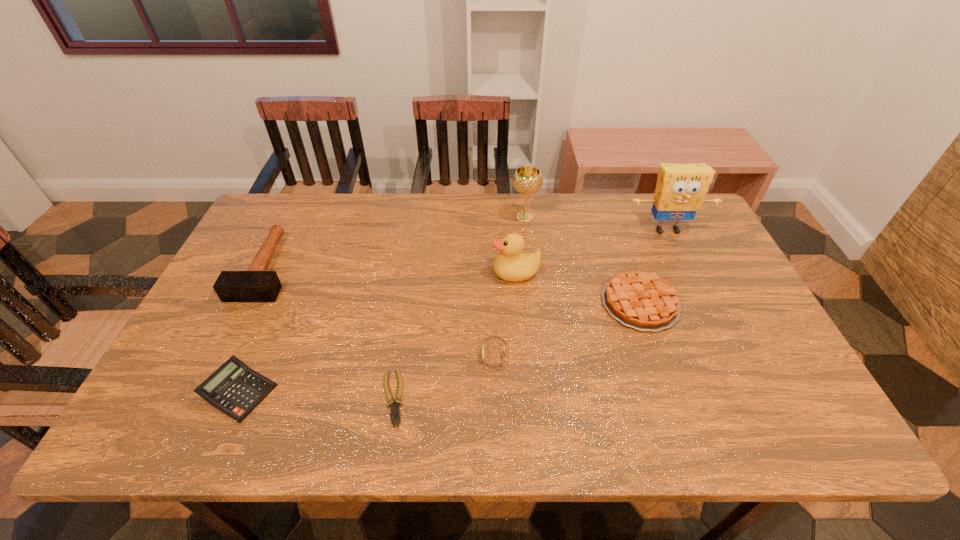
Locate an element on the screen. This screenshot has height=540, width=960. blank area located 0.300m on the right of the sixth object from right to left is located at coordinates (537, 399).

Locate an element on the screen. The image size is (960, 540). sponge at the far edge is located at coordinates (680, 190).

Locate an element on the screen. chalice positioned at the far edge is located at coordinates (527, 180).

The width and height of the screenshot is (960, 540). Identify the location of mallet at the far edge. (256, 284).

Locate an element on the screen. This screenshot has height=540, width=960. calculator located in the near edge section of the desktop is located at coordinates (235, 389).

The width and height of the screenshot is (960, 540). I want to click on pliers that is at the near edge, so click(394, 409).

You are a GUI agent. You are given a task and a screenshot of the screen. Output one action in this format:
    pyautogui.click(x=<x>, y=<y>)
    Task: Click on the mallet that is at the left edge
    
    Given the screenshot: What is the action you would take?
    pyautogui.click(x=256, y=284)

The width and height of the screenshot is (960, 540). Identify the location of calculator that is at the left edge. (235, 389).

The width and height of the screenshot is (960, 540). I want to click on object that is at the right edge, so click(x=680, y=190).

Locate an element on the screen. object located at the far left corner is located at coordinates (x=256, y=284).